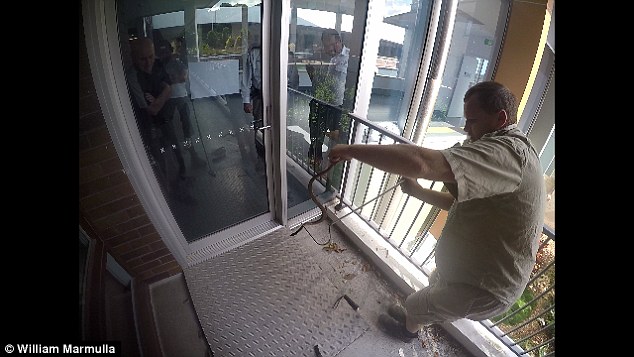
I want to click on floor, so click(x=181, y=314).